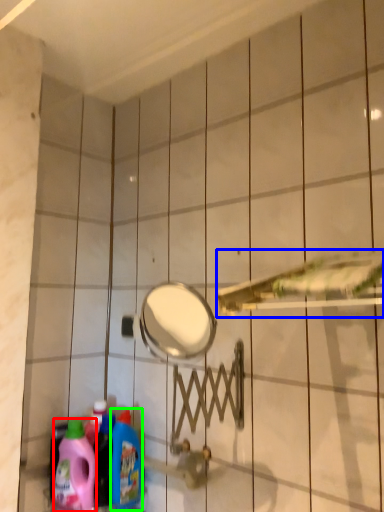
Question: Which object is the closest to the cleaning product (highlighted by a red box)? Choose among these: shower (highlighted by a blue box) or cleaning product (highlighted by a green box).

Choices:
 (A) shower
 (B) cleaning product

Answer: (B)